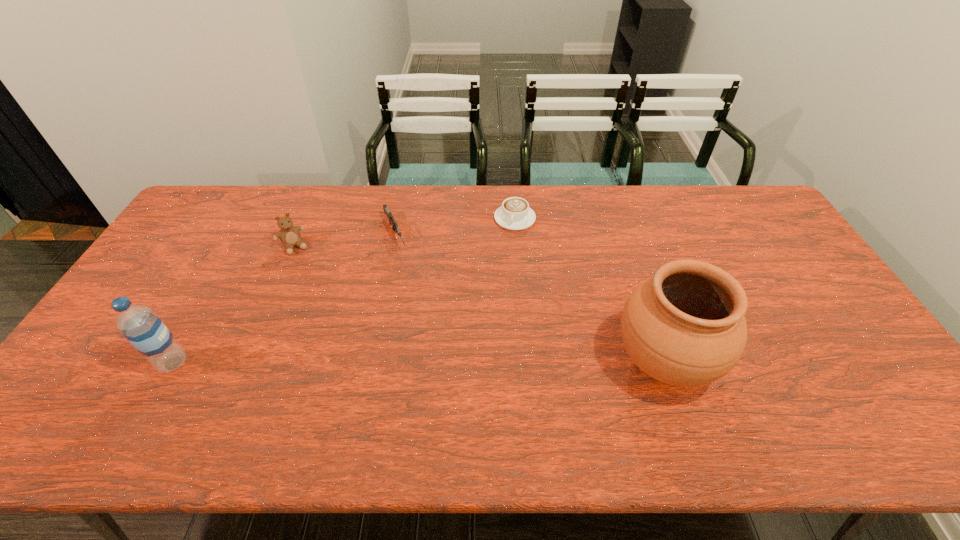
Where is `empty space between the rightmost object and the leftmost object`? This screenshot has width=960, height=540. empty space between the rightmost object and the leftmost object is located at coordinates (419, 362).

Find the location of a particular element. vacant area that lies between the water bottle and the cappuccino is located at coordinates (344, 291).

Find the location of a particular element. Image resolution: width=960 pixels, height=540 pixels. empty location between the fourth object from right to left and the gun is located at coordinates (345, 240).

Find the location of a particular element. vacant space in between the cappuccino and the pottery is located at coordinates (588, 290).

Point out which object is positioned as the fourth nearest to the leftmost object. Please provide its 2D coordinates. Your answer should be formatted as a tuple, i.e. [(x, y)], where the tuple contains the x and y coordinates of a point satisfying the conditions above.

[(685, 326)]

Locate an element on the screen. The image size is (960, 540). object that ranks as the fourth closest to the water bottle is located at coordinates (685, 326).

The height and width of the screenshot is (540, 960). Find the location of `free space that satisfies the following two spatial constraints: 1. on the back side of the teddy bear; 2. on the left side of the third object from right to left`. free space that satisfies the following two spatial constraints: 1. on the back side of the teddy bear; 2. on the left side of the third object from right to left is located at coordinates (300, 233).